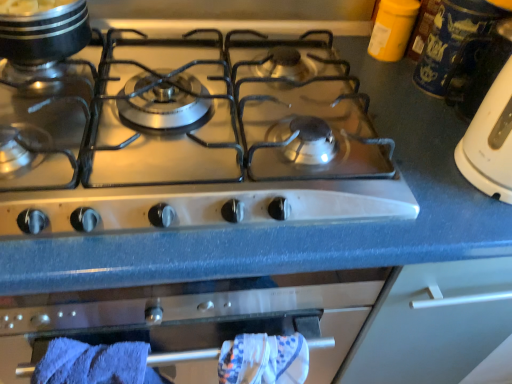
Question: Can blue soft towel at lower left be found inside blue ceramic mug at upper right?

Choices:
 (A) yes
 (B) no

Answer: (B)

Question: Can you confirm if blue ceramic mug at upper right is shorter than blue soft towel at lower left?

Choices:
 (A) yes
 (B) no

Answer: (A)

Question: Is blue ceramic mug at upper right not inside blue soft towel at lower left?

Choices:
 (A) no
 (B) yes

Answer: (B)

Question: Does blue ceramic mug at upper right have a lesser width compared to blue soft towel at lower left?

Choices:
 (A) no
 (B) yes

Answer: (A)

Question: From the image's perspective, would you say blue ceramic mug at upper right is shown under blue soft towel at lower left?

Choices:
 (A) yes
 (B) no

Answer: (B)

Question: In terms of width, does blue soft towel at lower left look wider or thinner when compared to shiny metallic pot at upper left?

Choices:
 (A) thin
 (B) wide

Answer: (A)

Question: Considering the positions of blue soft towel at lower left and shiny metallic pot at upper left in the image, is blue soft towel at lower left taller or shorter than shiny metallic pot at upper left?

Choices:
 (A) tall
 (B) short

Answer: (A)

Question: Based on their sizes in the image, would you say blue soft towel at lower left is bigger or smaller than shiny metallic pot at upper left?

Choices:
 (A) small
 (B) big

Answer: (B)

Question: Do you think blue soft towel at lower left is within shiny metallic pot at upper left, or outside of it?

Choices:
 (A) inside
 (B) outside

Answer: (B)

Question: Is shiny metallic pot at upper left inside the boundaries of blue ceramic mug at upper right, or outside?

Choices:
 (A) inside
 (B) outside

Answer: (B)

Question: Is point (64, 29) closer or farther from the camera than point (476, 6)?

Choices:
 (A) closer
 (B) farther

Answer: (A)

Question: Considering their positions, is shiny metallic pot at upper left located in front of or behind blue ceramic mug at upper right?

Choices:
 (A) front
 (B) behind

Answer: (A)

Question: Considering the relative positions of shiny metallic pot at upper left and blue ceramic mug at upper right in the image provided, is shiny metallic pot at upper left to the left or to the right of blue ceramic mug at upper right?

Choices:
 (A) left
 (B) right

Answer: (A)

Question: Is satin silver gas stove at center situated inside shiny metallic pot at upper left or outside?

Choices:
 (A) outside
 (B) inside

Answer: (A)

Question: Relative to shiny metallic pot at upper left, is satin silver gas stove at center in front or behind?

Choices:
 (A) behind
 (B) front

Answer: (B)